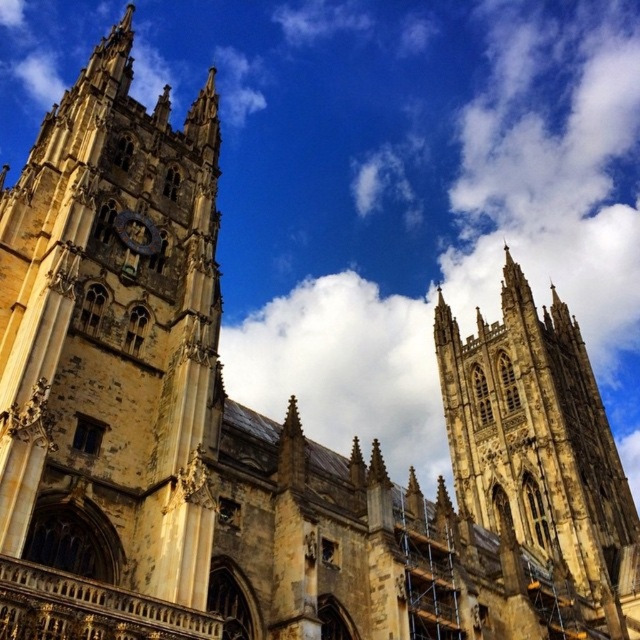
You are a tourist standing in front of the cathedral and want to take a photo that includes both the yellow stone tower at center and the gold metallic clock at center. Which object will appear bigger in your photo?

The yellow stone tower at center will appear bigger in the photo because it has a larger size compared to the gold metallic clock at center.

Based on the photo, you are standing in front of the cathedral and notice two points on its facade. The first point is at coordinates point (186, 408) and the second is at point (150, 237). Which point is closer to you?

Point (186, 408) is closer to the viewer than point (150, 237).